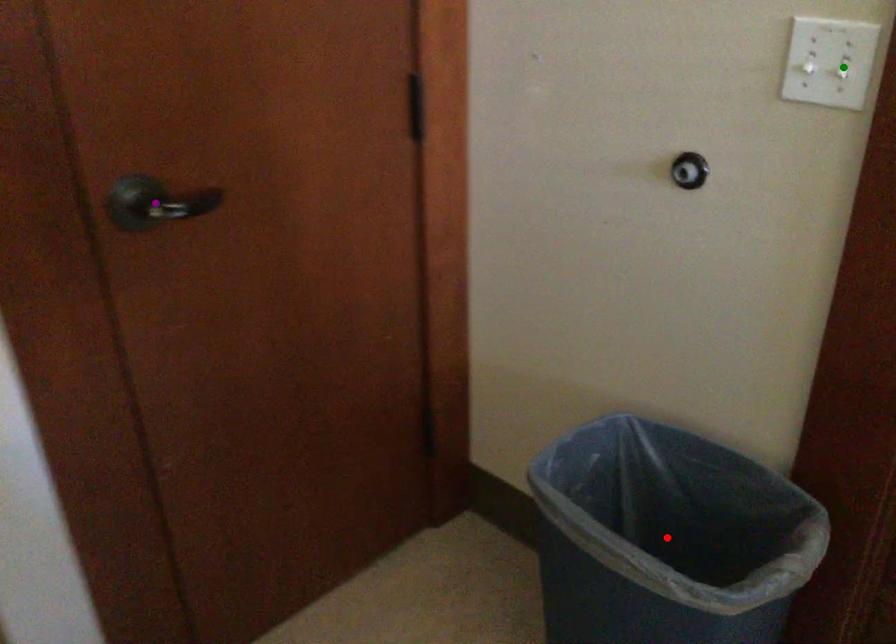
Order these from farthest to nearest:
purple point | red point | green point

red point, purple point, green point